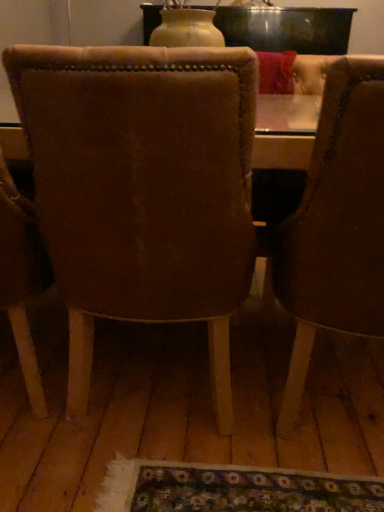
The image size is (384, 512). What do you see at coordinates (142, 189) in the screenshot?
I see `suede-like brown chair at center, the second chair in the right-to-left sequence` at bounding box center [142, 189].

Locate an element on the screen. The height and width of the screenshot is (512, 384). suede-like brown chair at center, which is the 1th chair from left to right is located at coordinates (142, 189).

In order to face brown leather chair at right, the 1th chair in the right-to-left sequence, should I rotate leftwards or rightwards?

You should rotate right by 22.497 degrees.

The height and width of the screenshot is (512, 384). Describe the element at coordinates (335, 225) in the screenshot. I see `brown leather chair at right, the 1th chair in the right-to-left sequence` at that location.

I want to click on brown leather chair at right, the 1th chair in the right-to-left sequence, so click(x=335, y=225).

This screenshot has height=512, width=384. In order to click on suede-like brown chair at center, which is the 1th chair from left to right in this screenshot , I will do `click(142, 189)`.

Is suede-like brown chair at center, the second chair in the right-to-left sequence, to the left of brown leather chair at right, the 1th chair in the right-to-left sequence, from the viewer's perspective?

Correct, you'll find suede-like brown chair at center, the second chair in the right-to-left sequence, to the left of brown leather chair at right, the 1th chair in the right-to-left sequence.

Considering the positions of objects suede-like brown chair at center, the second chair in the right-to-left sequence, and brown leather chair at right, the 1th chair in the right-to-left sequence, in the image provided, who is in front, suede-like brown chair at center, the second chair in the right-to-left sequence, or brown leather chair at right, the 1th chair in the right-to-left sequence,?

brown leather chair at right, the 1th chair in the right-to-left sequence, is in front.

Does point (216, 379) come closer to viewer compared to point (295, 305)?

No, it is not.

From the image's perspective, is suede-like brown chair at center, the second chair in the right-to-left sequence, positioned above or below brown leather chair at right, the 1th chair in the right-to-left sequence?

Clearly, from the image's perspective, suede-like brown chair at center, the second chair in the right-to-left sequence, is above brown leather chair at right, the 1th chair in the right-to-left sequence.

From a real-world perspective, between suede-like brown chair at center, which is the 1th chair from left to right, and brown leather chair at right, the 1th chair in the right-to-left sequence, who is vertically higher?

From a 3D spatial view, brown leather chair at right, the 1th chair in the right-to-left sequence, is above.

Which of these two, suede-like brown chair at center, the second chair in the right-to-left sequence, or brown leather chair at right, which is the 2th chair in left-to-right order, is wider?

brown leather chair at right, which is the 2th chair in left-to-right order, is wider.

Is suede-like brown chair at center, the second chair in the right-to-left sequence, taller than brown leather chair at right, the 1th chair in the right-to-left sequence?

Yes.

Which of these two, suede-like brown chair at center, which is the 1th chair from left to right, or brown leather chair at right, the 1th chair in the right-to-left sequence, is bigger?

brown leather chair at right, the 1th chair in the right-to-left sequence.

Do you think suede-like brown chair at center, which is the 1th chair from left to right, is within brown leather chair at right, the 1th chair in the right-to-left sequence, or outside of it?

suede-like brown chair at center, which is the 1th chair from left to right, is not inside brown leather chair at right, the 1th chair in the right-to-left sequence, it's outside.

Is the surface of suede-like brown chair at center, which is the 1th chair from left to right, in direct contact with brown leather chair at right, the 1th chair in the right-to-left sequence?

suede-like brown chair at center, which is the 1th chair from left to right, is not next to brown leather chair at right, the 1th chair in the right-to-left sequence, and they're not touching.

Could you tell me if suede-like brown chair at center, which is the 1th chair from left to right, is facing brown leather chair at right, which is the 2th chair in left-to-right order?

No, suede-like brown chair at center, which is the 1th chair from left to right, is not oriented towards brown leather chair at right, which is the 2th chair in left-to-right order.

How different are the orientations of suede-like brown chair at center, which is the 1th chair from left to right, and brown leather chair at right, which is the 2th chair in left-to-right order, in degrees?

The facing directions of suede-like brown chair at center, which is the 1th chair from left to right, and brown leather chair at right, which is the 2th chair in left-to-right order, are 0.000599 degrees apart.

Identify the location of chair behind the brown leather chair at right, which is the 2th chair in left-to-right order. (142, 189).

Does brown leather chair at right, which is the 2th chair in left-to-right order, appear on the right side of suede-like brown chair at center, which is the 1th chair from left to right?

Yes.

Which object is closer to the camera taking this photo, brown leather chair at right, which is the 2th chair in left-to-right order, or suede-like brown chair at center, which is the 1th chair from left to right?

brown leather chair at right, which is the 2th chair in left-to-right order, is closer to the camera.

Is point (292, 405) positioned behind point (208, 71)?

Yes, it is behind point (208, 71).

From the image's perspective, is brown leather chair at right, which is the 2th chair in left-to-right order, located above suede-like brown chair at center, which is the 1th chair from left to right?

No, from the image's perspective, brown leather chair at right, which is the 2th chair in left-to-right order, is not over suede-like brown chair at center, which is the 1th chair from left to right.

From a real-world perspective, which object stands above the other?

In real-world perspective, brown leather chair at right, which is the 2th chair in left-to-right order, is above.

Considering the sizes of objects brown leather chair at right, which is the 2th chair in left-to-right order, and suede-like brown chair at center, the second chair in the right-to-left sequence, in the image provided, who is thinner, brown leather chair at right, which is the 2th chair in left-to-right order, or suede-like brown chair at center, the second chair in the right-to-left sequence,?

suede-like brown chair at center, the second chair in the right-to-left sequence.

Is brown leather chair at right, which is the 2th chair in left-to-right order, taller than suede-like brown chair at center, which is the 1th chair from left to right?

In fact, brown leather chair at right, which is the 2th chair in left-to-right order, may be shorter than suede-like brown chair at center, which is the 1th chair from left to right.

In terms of size, does brown leather chair at right, which is the 2th chair in left-to-right order, appear bigger or smaller than suede-like brown chair at center, the second chair in the right-to-left sequence?

Clearly, brown leather chair at right, which is the 2th chair in left-to-right order, is larger in size than suede-like brown chair at center, the second chair in the right-to-left sequence.

Consider the image. Is brown leather chair at right, the 1th chair in the right-to-left sequence, completely or partially outside of suede-like brown chair at center, the second chair in the right-to-left sequence?

brown leather chair at right, the 1th chair in the right-to-left sequence, is positioned outside suede-like brown chair at center, the second chair in the right-to-left sequence.

Is there a large distance between brown leather chair at right, the 1th chair in the right-to-left sequence, and suede-like brown chair at center, which is the 1th chair from left to right?

brown leather chair at right, the 1th chair in the right-to-left sequence, is actually quite close to suede-like brown chair at center, which is the 1th chair from left to right.

Is brown leather chair at right, the 1th chair in the right-to-left sequence, aimed at suede-like brown chair at center, the second chair in the right-to-left sequence?

No, brown leather chair at right, the 1th chair in the right-to-left sequence, is not turned towards suede-like brown chair at center, the second chair in the right-to-left sequence.

In the scene shown: How many degrees apart are the facing directions of brown leather chair at right, the 1th chair in the right-to-left sequence, and suede-like brown chair at center, which is the 1th chair from left to right?

The facing directions of brown leather chair at right, the 1th chair in the right-to-left sequence, and suede-like brown chair at center, which is the 1th chair from left to right, are 0.000599 degrees apart.

How much distance is there between brown leather chair at right, which is the 2th chair in left-to-right order, and suede-like brown chair at center, the second chair in the right-to-left sequence?

They are 10.67 inches apart.

This screenshot has height=512, width=384. Find the location of `chair beneath the brown leather chair at right, which is the 2th chair in left-to-right order (from a real-world perspective)`. chair beneath the brown leather chair at right, which is the 2th chair in left-to-right order (from a real-world perspective) is located at coordinates (142, 189).

The image size is (384, 512). What are the coordinates of `chair on the right of suede-like brown chair at center, the second chair in the right-to-left sequence` in the screenshot? It's located at (335, 225).

What are the coordinates of `chair below the brown leather chair at right, which is the 2th chair in left-to-right order (from a real-world perspective)` in the screenshot? It's located at (142, 189).